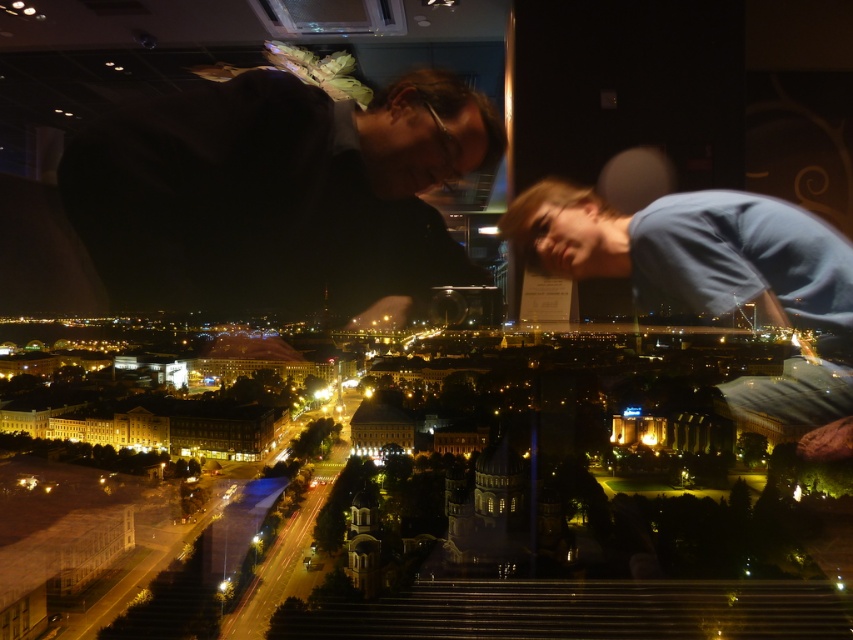
You are standing at the observation deck and see two people in front of you. One is wearing a dark matte shirt at upper left and the other a blue cotton shirt at upper right. Which person is closer to you?

The dark matte shirt at upper left is closer to you because the blue cotton shirt at upper right is behind it.

You are standing at the observation deck and see two points in the city lights below. The first point is at coordinates point (372, 124) and the second is at point (721, 284). Which point is closer to you?

Point (372, 124) is further to the camera than point (721, 284). Therefore, the point closer to you is point (721, 284).